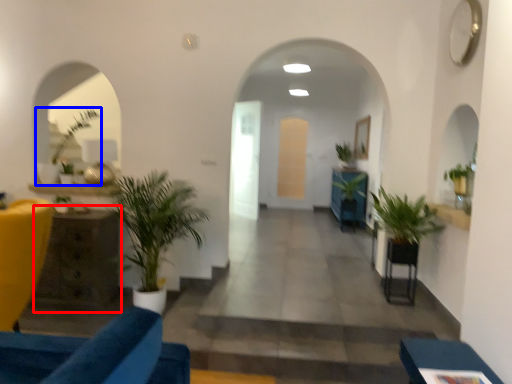
Question: Which point is closer to the camera, table (highlighted by a red box) or houseplant (highlighted by a blue box)?

Choices:
 (A) table
 (B) houseplant

Answer: (A)